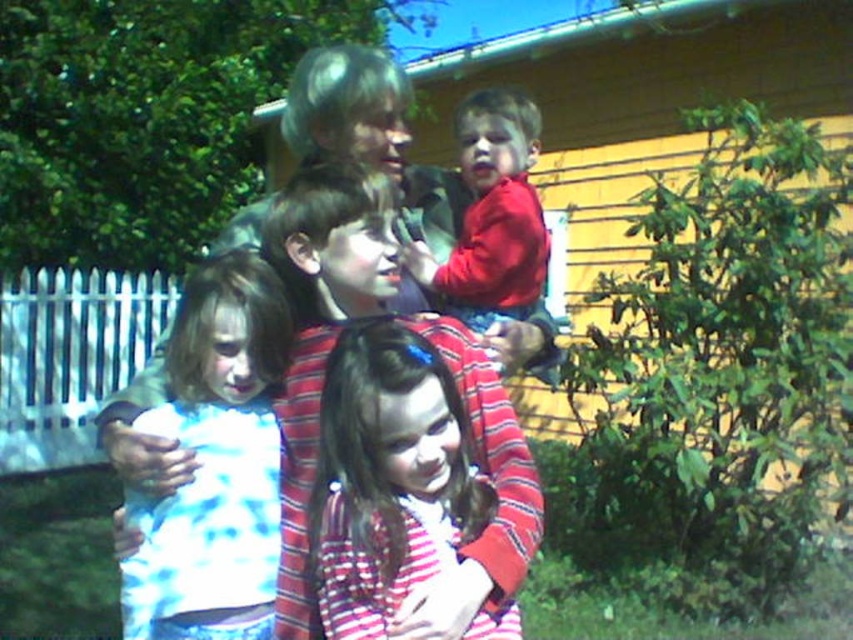
Question: Can you confirm if white tie-dye shirt at center is positioned to the left of matte red shirt at center?

Choices:
 (A) yes
 (B) no

Answer: (A)

Question: Which object appears closest to the camera in this image?

Choices:
 (A) matte red shirt at center
 (B) striped fabric shirt at center
 (C) white tie-dye shirt at center

Answer: (B)

Question: Does striped fabric shirt at center appear over matte red shirt at center?

Choices:
 (A) yes
 (B) no

Answer: (B)

Question: Among these objects, which one is nearest to the camera?

Choices:
 (A) striped fabric shirt at center
 (B) white tie-dye shirt at center

Answer: (A)

Question: Among these objects, which one is farthest from the camera?

Choices:
 (A) striped fabric shirt at center
 (B) matte red shirt at center
 (C) white tie-dye shirt at center

Answer: (B)

Question: Can you confirm if white tie-dye shirt at center is smaller than matte red shirt at center?

Choices:
 (A) no
 (B) yes

Answer: (B)